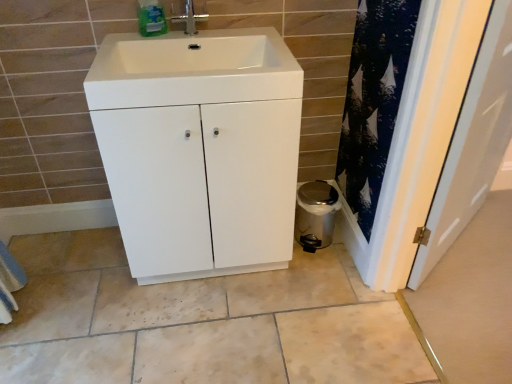
Question: Is the depth of silver metallic tap at upper center less than that of white matte cabinet at center?

Choices:
 (A) no
 (B) yes

Answer: (A)

Question: Is silver metallic tap at upper center with white matte cabinet at center?

Choices:
 (A) yes
 (B) no

Answer: (B)

Question: Considering the relative sizes of silver metallic tap at upper center and white matte cabinet at center in the image provided, is silver metallic tap at upper center smaller than white matte cabinet at center?

Choices:
 (A) yes
 (B) no

Answer: (A)

Question: Can you confirm if silver metallic tap at upper center is taller than white matte cabinet at center?

Choices:
 (A) no
 (B) yes

Answer: (A)

Question: From the image's perspective, is silver metallic tap at upper center below white matte cabinet at center?

Choices:
 (A) no
 (B) yes

Answer: (A)

Question: Is silver metallic tap at upper center oriented away from white matte cabinet at center?

Choices:
 (A) yes
 (B) no

Answer: (B)

Question: Could you tell me if white glossy sink at center is turned towards white matte cabinet at center?

Choices:
 (A) no
 (B) yes

Answer: (A)

Question: From the image's perspective, is white glossy sink at center on white matte cabinet at center?

Choices:
 (A) no
 (B) yes

Answer: (B)

Question: Is white glossy sink at center far away from white matte cabinet at center?

Choices:
 (A) no
 (B) yes

Answer: (A)

Question: Can you confirm if white glossy sink at center is positioned to the left of white matte cabinet at center?

Choices:
 (A) yes
 (B) no

Answer: (A)

Question: Does white glossy sink at center have a smaller size compared to white matte cabinet at center?

Choices:
 (A) yes
 (B) no

Answer: (A)

Question: Does white glossy sink at center have a lesser width compared to white matte cabinet at center?

Choices:
 (A) no
 (B) yes

Answer: (B)

Question: Is white glossy sink at center further to the viewer compared to metallic trash can at lower right?

Choices:
 (A) no
 (B) yes

Answer: (A)